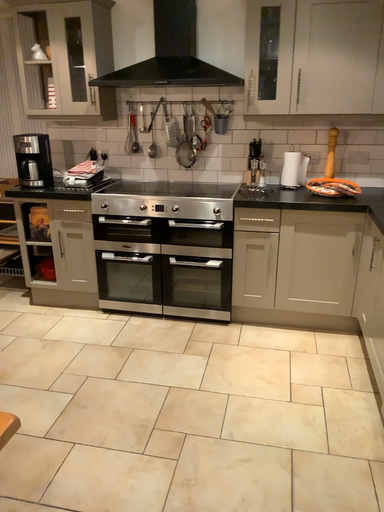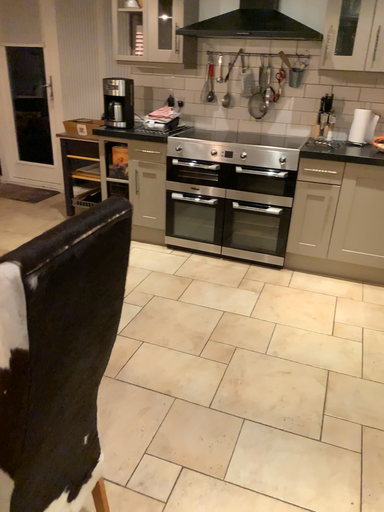
Question: Which way did the camera rotate in the video?

Choices:
 (A) rotated left
 (B) rotated right

Answer: (A)